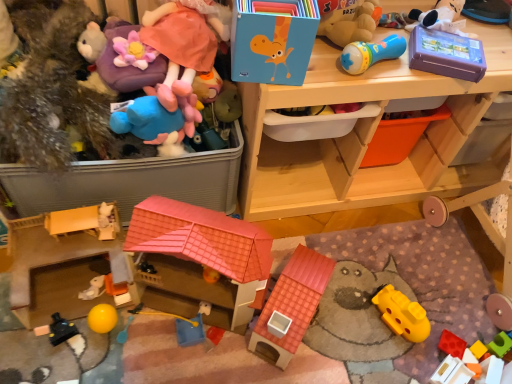
I want to click on empty space that is in between rubberized plastic blocks at lower right, positioned as the first toy in right-to-left order, and black plastic toy at lower left, the 13th toy viewed from the right, so click(270, 346).